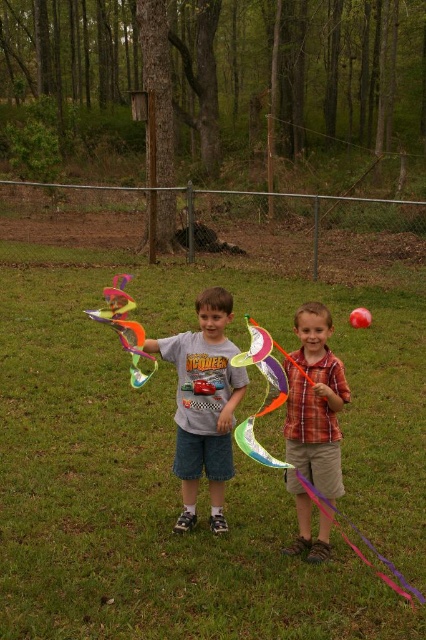
From the picture: You are standing in the grassy area and see a point marked at coordinates (313,424). According to the image, what object is this point located on?

The point at coordinates (313,424) is located on the plaid cotton shirt at center.

You are a photographer trying to capture both the plaid cotton shirt at center and the rainbow plastic kite at center in a single frame. Given their sizes, which one will appear smaller in the photo?

The plaid cotton shirt at center will appear smaller in the photo because it has a lesser width compared to the rainbow plastic kite at center.

You are standing at the origin point of the image. Which direction should you move to reach the plaid cotton shirt at center?

The plaid cotton shirt at center is located at coordinates point (313, 424), so you should move towards the right and slightly downward from your current position to reach it.